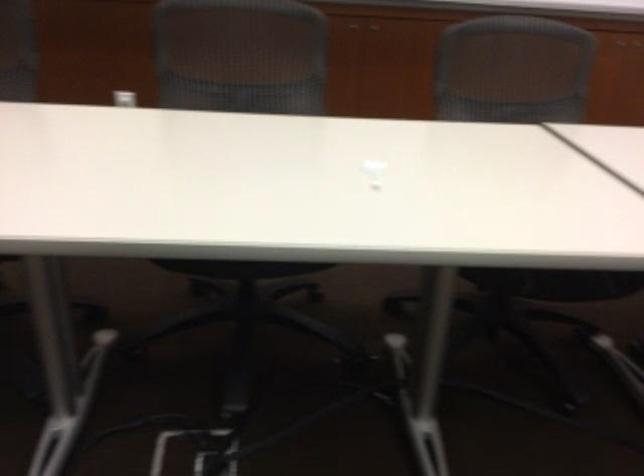
Describe the element at coordinates (125, 96) in the screenshot. I see `the white chair lever` at that location.